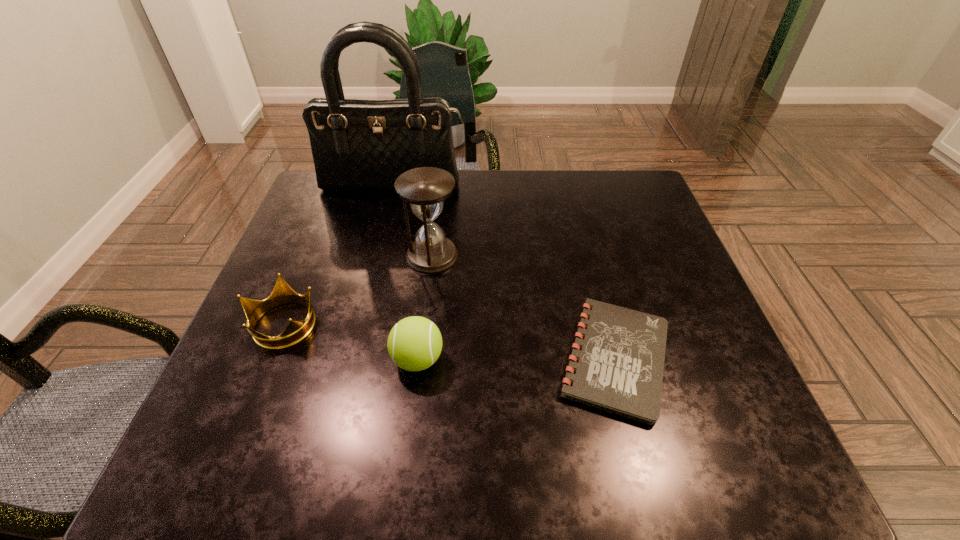
The width and height of the screenshot is (960, 540). What are the coordinates of `vacant space at the left edge of the desktop` in the screenshot? It's located at (240, 372).

Identify the location of vacant space at the right edge of the desktop. The height and width of the screenshot is (540, 960). (695, 403).

The height and width of the screenshot is (540, 960). In the image, there is a desktop. What are the coordinates of `blank space at the near left corner` in the screenshot? It's located at (249, 439).

Identify the location of free space at the far right corner. (623, 214).

The height and width of the screenshot is (540, 960). In order to click on vacant space at the near right corner of the desktop in this screenshot , I will do `click(678, 434)`.

The height and width of the screenshot is (540, 960). What are the coordinates of `vacant region between the fourth nearest object and the tennis ball` in the screenshot? It's located at (425, 307).

Locate an element on the screen. The width and height of the screenshot is (960, 540). empty location between the hourglass and the shortest object is located at coordinates (524, 307).

Identify the location of free point between the rightmost object and the crown. (449, 341).

Find the location of `free space between the rightmost object and the second tallest object`. free space between the rightmost object and the second tallest object is located at coordinates (524, 307).

Find the location of `free space between the hourglass and the fourth tallest object`. free space between the hourglass and the fourth tallest object is located at coordinates (358, 289).